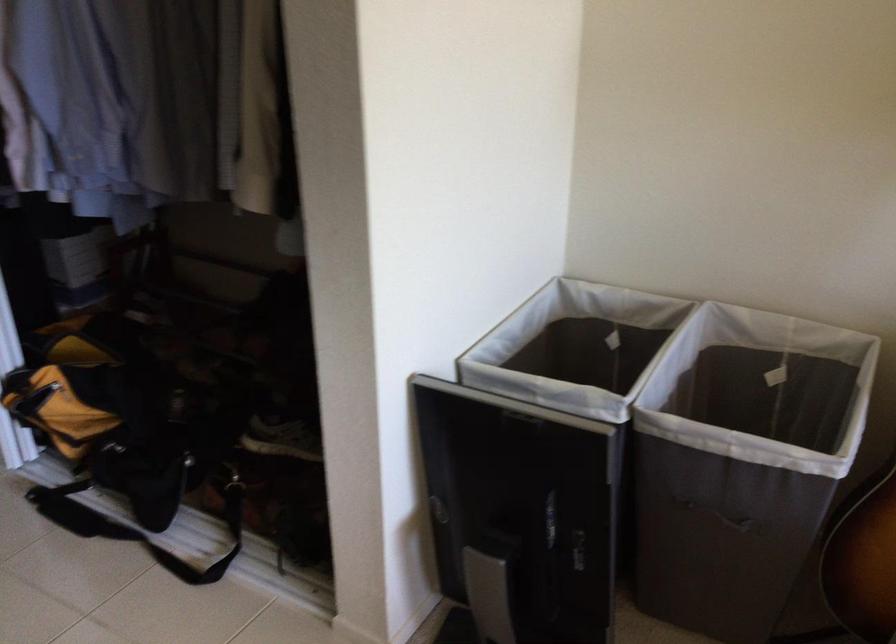
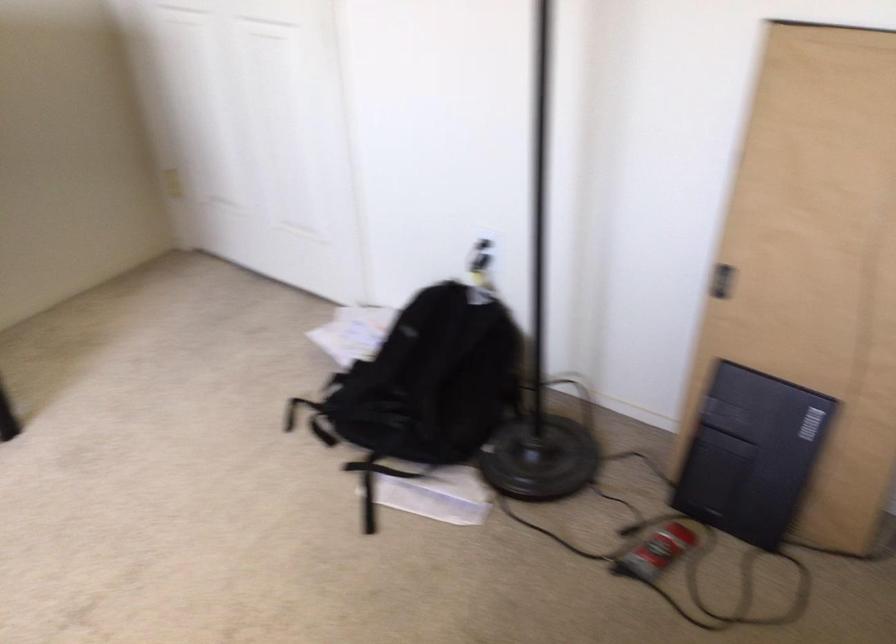
The first image is from the beginning of the video and the second image is from the end. How did the camera likely rotate when shooting the video?

The camera rotated toward left-down.